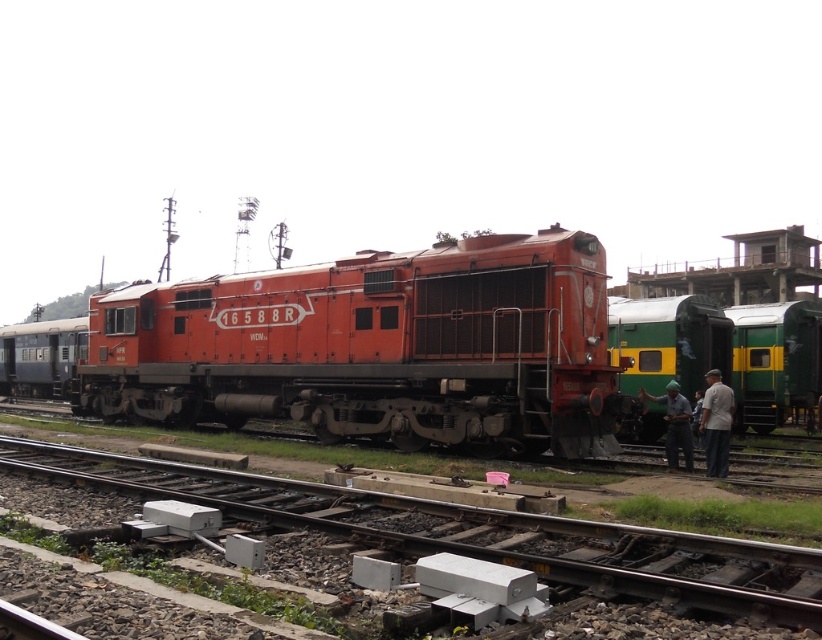
You are standing in front of the red locomotive labeled 16588R and want to place a small flag at one of two points, either point (460, 268) or point (691, 337). Which point is closer to you?

Point (460, 268) is closer to the viewer than point (691, 337), so you should place the flag at point (460, 268).

From the picture: You are a photographer standing at the scene. You want to take a photo of the matte orange locomotive at center and the light gray fabric pants at lower right. Which object will appear larger in the photo?

The matte orange locomotive at center will appear larger in the photo because it is much taller than the light gray fabric pants at lower right.